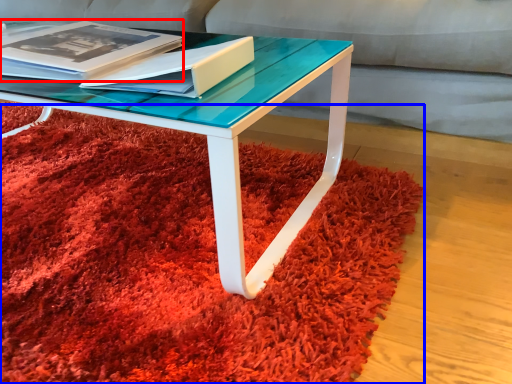
Question: Which point is further to the camera, magazine (highlighted by a red box) or mat (highlighted by a blue box)?

Choices:
 (A) magazine
 (B) mat

Answer: (A)